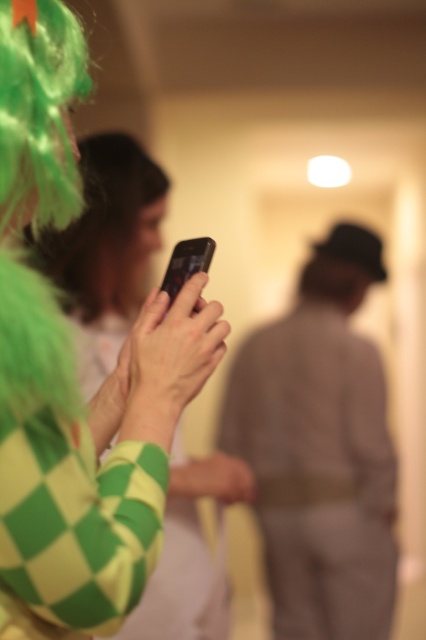
Who is more distant from viewer, (150,189) or (206,636)?

The point (150,189) is more distant.

Between point (198, 365) and point (184, 611), which one is positioned behind?

Positioned behind is point (184, 611).

The image size is (426, 640). In order to click on green checkered shirt at center in this screenshot , I will do `click(106, 250)`.

Is light brown fabric suit at center to the left of green checkered shirt at center from the viewer's perspective?

In fact, light brown fabric suit at center is to the right of green checkered shirt at center.

Which is in front, point (230, 388) or point (91, 312)?

Point (91, 312) is in front.

Image resolution: width=426 pixels, height=640 pixels. I want to click on light brown fabric suit at center, so click(x=321, y=451).

At what (x,y) coordinates should I click in order to perform the action: click on green feathered wig at upper left. Please return your answer as a coordinate pair (x, y). Looking at the image, I should click on (106, 230).

Who is lower down, green feathered wig at upper left or green checkered fabric at center?

Positioned lower is green checkered fabric at center.

Image resolution: width=426 pixels, height=640 pixels. Find the location of `green feathered wig at upper left`. green feathered wig at upper left is located at coordinates (106, 230).